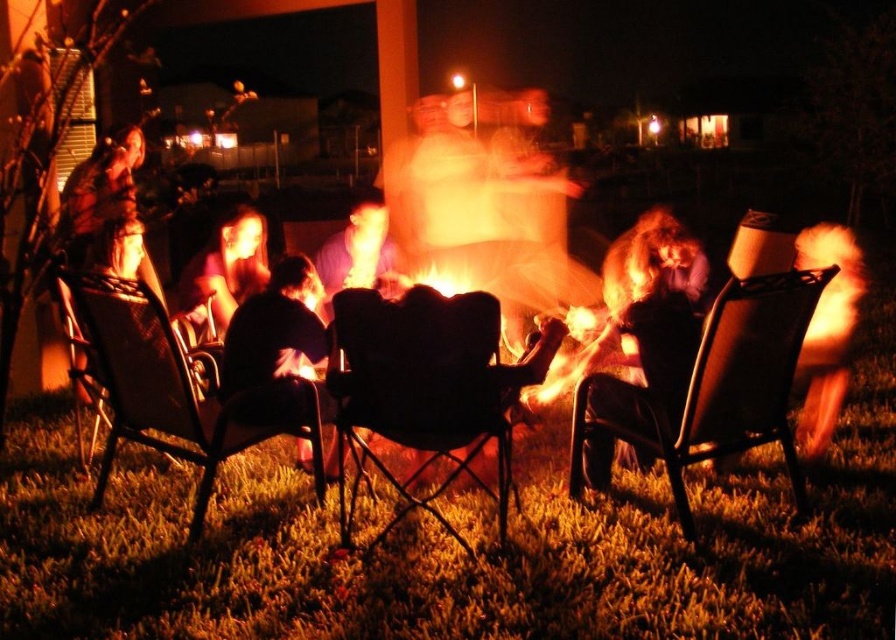
You are a photographer trying to capture a candid shot of the metallic black chair at center and the blonde hair at right. You need to ensure both subjects are in focus. Given that your camera has a depth of field that can cover 12 inches, will you be able to capture both subjects clearly in the same shot?

The metallic black chair at center and the blonde hair at right are 11.54 inches apart from each other. Since the distance between them is within the camera depth of field of 12 inches, both subjects can be captured clearly in focus.

You are a guest at this gathering and want to sit down. You see the metallic black chair at left and the dark fabric chair at center. Which chair is taller?

The metallic black chair at left is taller than the dark fabric chair at center.

You are a photographer standing at the edge of the fire pit scene. You want to take a photo of the metallic black chair at center and the blonde hair at right so that both are clearly visible. Considering their heights, which object should you focus on first to ensure proper focus?

The metallic black chair at center is taller than the blonde hair at right, so you should focus on the metallic black chair at center first to ensure proper focus.